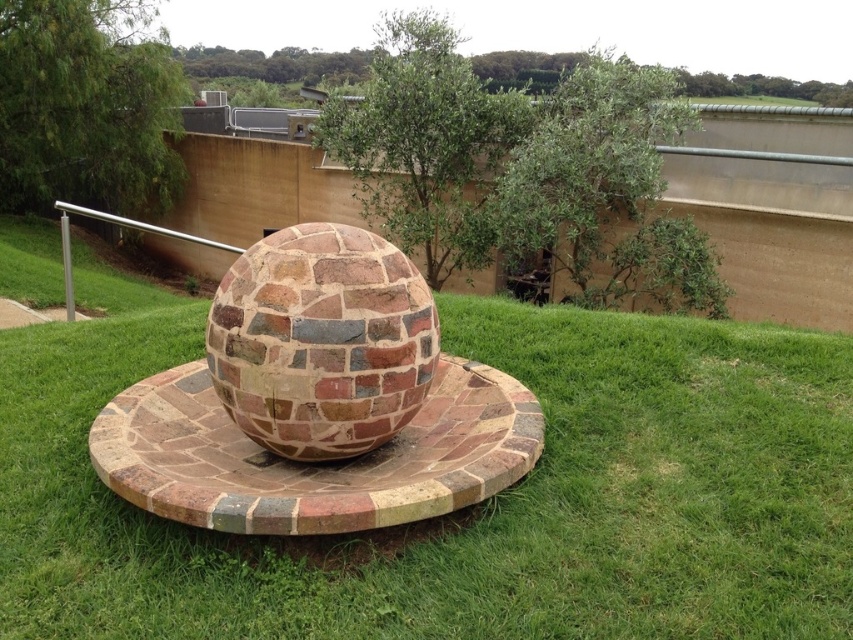
In the scene shown: Who is higher up, green grass at center or brick-patterned sphere at center?

Positioned higher is brick-patterned sphere at center.

Can you confirm if green grass at center is thinner than brick-patterned sphere at center?

No, green grass at center is not thinner than brick-patterned sphere at center.

Is point (339, 593) less distant than point (381, 416)?

Yes, point (339, 593) is in front of point (381, 416).

Locate an element on the screen. This screenshot has height=640, width=853. green grass at center is located at coordinates (467, 509).